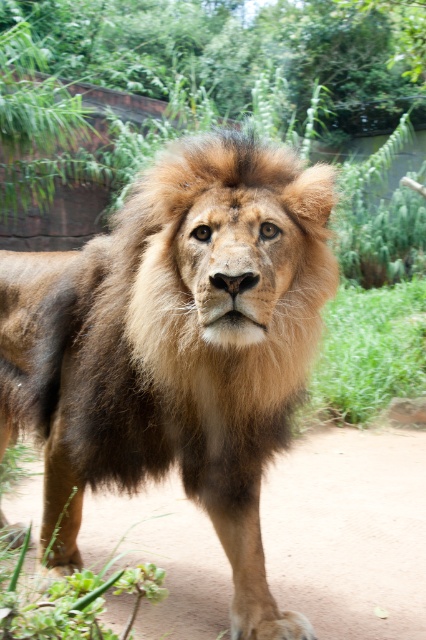
This screenshot has width=426, height=640. Describe the element at coordinates (175, 348) in the screenshot. I see `brown fuzzy lion at center` at that location.

Does brown fuzzy lion at center appear on the right side of brown furry leg at center?

Incorrect, brown fuzzy lion at center is not on the right side of brown furry leg at center.

The width and height of the screenshot is (426, 640). Identify the location of brown fuzzy lion at center. (175, 348).